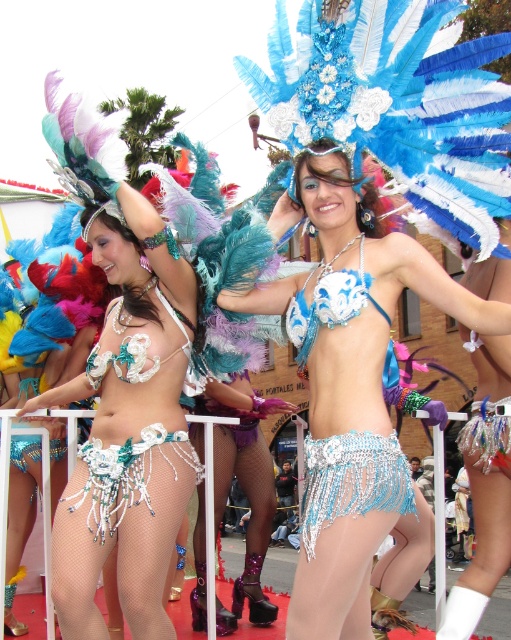
Question: Among these points, which one is nearest to the camera?

Choices:
 (A) (382, 477)
 (B) (384, 272)
 (C) (148, 508)

Answer: (A)

Question: Which of the following is the closest to the observer?

Choices:
 (A) shiny silver bikini top at center
 (B) matte silver bikini at center
 (C) shiny blue bikini at center
 (D) pearl beaded skirt at center

Answer: (C)

Question: Among these points, which one is farthest from the camera?

Choices:
 (A) (382, 308)
 (B) (158, 579)

Answer: (B)

Question: Is matte silver bikini at center thinner than pearl beaded skirt at center?

Choices:
 (A) no
 (B) yes

Answer: (A)

Question: Is shiny blue bikini at center in front of pearl beaded skirt at center?

Choices:
 (A) yes
 (B) no

Answer: (A)

Question: Considering the relative positions of matte silver bikini at center and shiny silver bikini top at center in the image provided, where is matte silver bikini at center located with respect to shiny silver bikini top at center?

Choices:
 (A) right
 (B) left

Answer: (B)